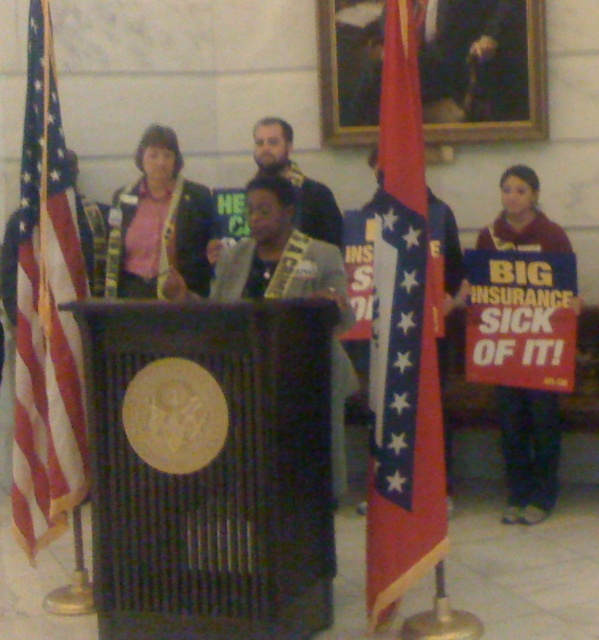
Question: From the image, what is the correct spatial relationship of red fabric flag at center in relation to matte pink shirt at center?

Choices:
 (A) left
 (B) right

Answer: (B)

Question: Which object is farther from the camera taking this photo?

Choices:
 (A) american flag at left
 (B) red fabric flag at center
 (C) matte pink shirt at center

Answer: (C)

Question: Estimate the real-world distances between objects in this image. Which object is closer to the maroon fabric sign at right?

Choices:
 (A) matte pink shirt at center
 (B) red fabric flag at center
 (C) american flag at left

Answer: (B)

Question: Does matte pink shirt at center come behind maroon fabric sign at right?

Choices:
 (A) yes
 (B) no

Answer: (A)

Question: Among these points, which one is nearest to the camera?

Choices:
 (A) (516, 452)
 (B) (49, 179)
 (C) (189, 284)
 (D) (397, 32)

Answer: (D)

Question: Can you confirm if american flag at left is positioned to the left of matte pink shirt at center?

Choices:
 (A) no
 (B) yes

Answer: (B)